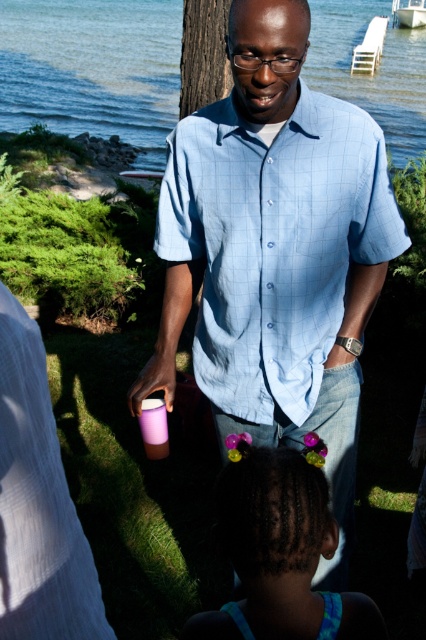
Does point (367, 598) come in front of point (141, 401)?

Yes, it is.

Which is behind, point (239, 636) or point (138, 385)?

Point (138, 385)

Image resolution: width=426 pixels, height=640 pixels. Find the location of `purple hairband at lower center`. purple hairband at lower center is located at coordinates tap(281, 550).

Between blue water at upper center and purple hairband at lower center, which one appears on the left side from the viewer's perspective?

blue water at upper center is more to the left.

Based on the photo, is blue water at upper center further to the viewer compared to purple hairband at lower center?

Yes, it is behind purple hairband at lower center.

Which is in front, point (339, 56) or point (273, 596)?

Point (273, 596) is more forward.

Locate an element on the screen. blue water at upper center is located at coordinates (92, 68).

Does light blue checkered shirt at center appear on the left side of blue water at upper center?

Incorrect, light blue checkered shirt at center is not on the left side of blue water at upper center.

Between point (271, 208) and point (118, 16), which one is positioned behind?

Positioned behind is point (118, 16).

You are a GUI agent. You are given a task and a screenshot of the screen. Output one action in this format:
    pyautogui.click(x=<x>, y=<y>)
    Task: Click on the light blue checkered shirt at center
    
    Given the screenshot: What is the action you would take?
    pyautogui.click(x=275, y=243)